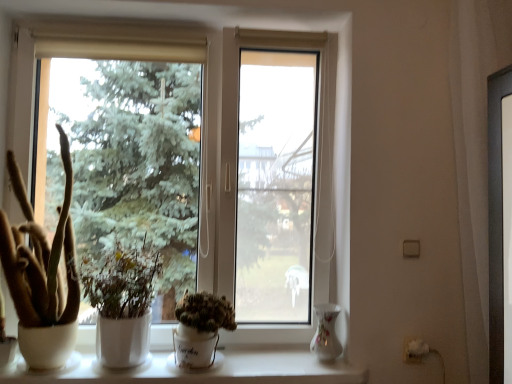
The height and width of the screenshot is (384, 512). Identify the location of vacant space underneath green matte cactus at center, which appears as the first houseplant when viewed from the right (from a real-world perspective). (203, 370).